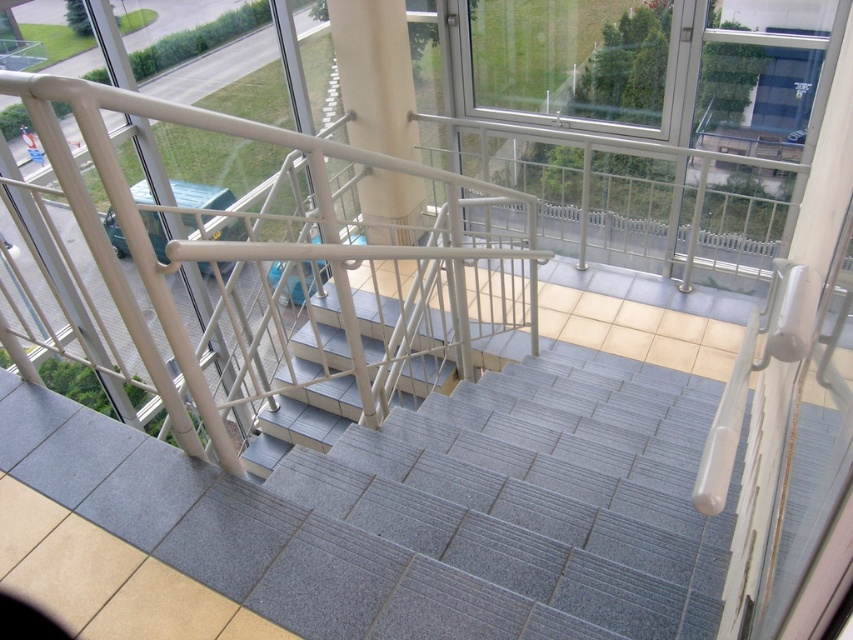
Between transparent glass window at upper center and gray textured stairs at center, which one is positioned higher?

transparent glass window at upper center

Locate an element on the screen. This screenshot has height=640, width=853. transparent glass window at upper center is located at coordinates click(x=668, y=83).

What are the coordinates of `transparent glass window at upper center` in the screenshot? It's located at (668, 83).

Is point (379, 240) positioned behind point (329, 369)?

That is True.

Does white glossy pillar at center have a greater height compared to gray textured stairs at center?

Indeed, white glossy pillar at center has a greater height compared to gray textured stairs at center.

Is point (340, 12) positioned behind point (317, 396)?

No, it is in front of (317, 396).

The width and height of the screenshot is (853, 640). I want to click on white glossy pillar at center, so click(375, 74).

Is transparent glass window at upper center below white glossy pillar at center?

No, transparent glass window at upper center is not below white glossy pillar at center.

Between point (494, 12) and point (354, 58), which one is positioned behind?

The point (494, 12) is behind.

Identify the location of transparent glass window at upper center. The image size is (853, 640). (668, 83).